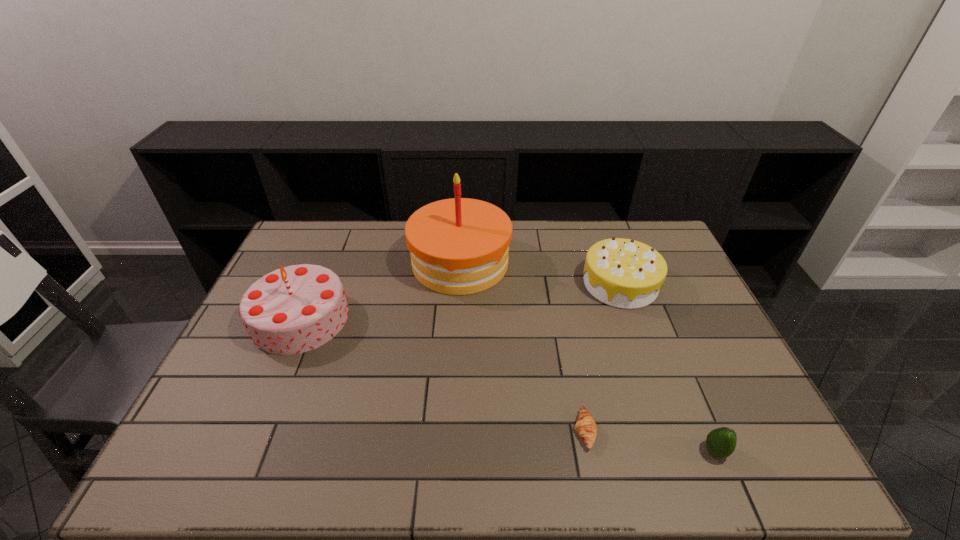
The image size is (960, 540). What are the coordinates of `avocado present at the right edge` in the screenshot? It's located at (721, 442).

At what (x,y) coordinates should I click in order to perform the action: click on object that is at the far right corner. Please return your answer as a coordinate pair (x, y). Image resolution: width=960 pixels, height=540 pixels. Looking at the image, I should click on [623, 273].

You are a GUI agent. You are given a task and a screenshot of the screen. Output one action in this format:
    pyautogui.click(x=<x>, y=<y>)
    Task: Click on the object that is at the near right corner
    Image resolution: width=960 pixels, height=540 pixels.
    Given the screenshot: What is the action you would take?
    pyautogui.click(x=721, y=442)

In the image, there is a desktop. Where is `vacant region at the far edge`? This screenshot has width=960, height=540. vacant region at the far edge is located at coordinates (519, 252).

In the image, there is a desktop. Where is `vacant region at the near edge`? Image resolution: width=960 pixels, height=540 pixels. vacant region at the near edge is located at coordinates (x=280, y=449).

Identify the location of blank space at the left edge of the desktop. (309, 263).

This screenshot has width=960, height=540. Identify the location of vacant space at the right edge. (679, 283).

This screenshot has width=960, height=540. I want to click on vacant space at the far right corner of the desktop, so click(x=635, y=222).

Where is `free spot between the leftmost birthday cake and the shortest object`? free spot between the leftmost birthday cake and the shortest object is located at coordinates (443, 375).

Identify the location of vacant region between the second tallest object and the shortest object. This screenshot has height=540, width=960. (443, 375).